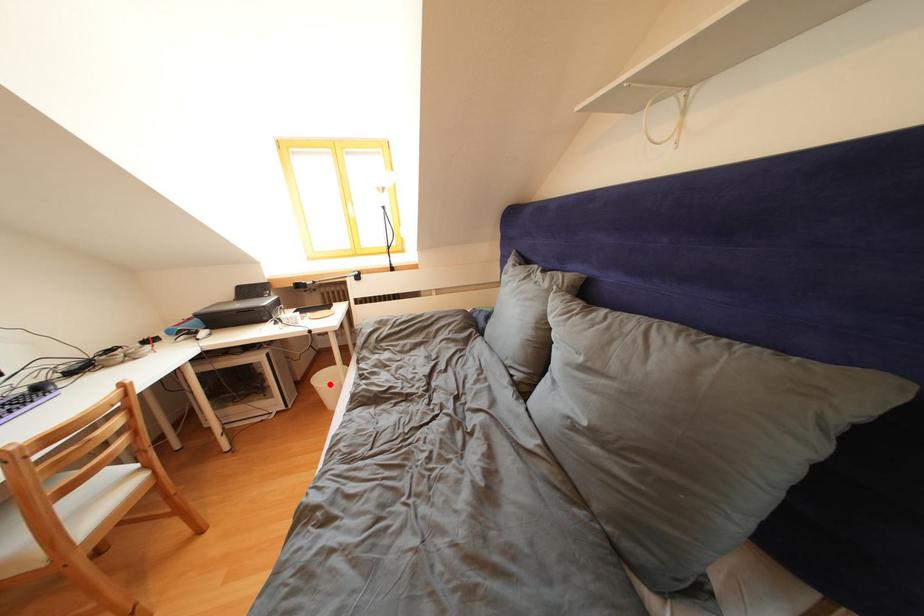
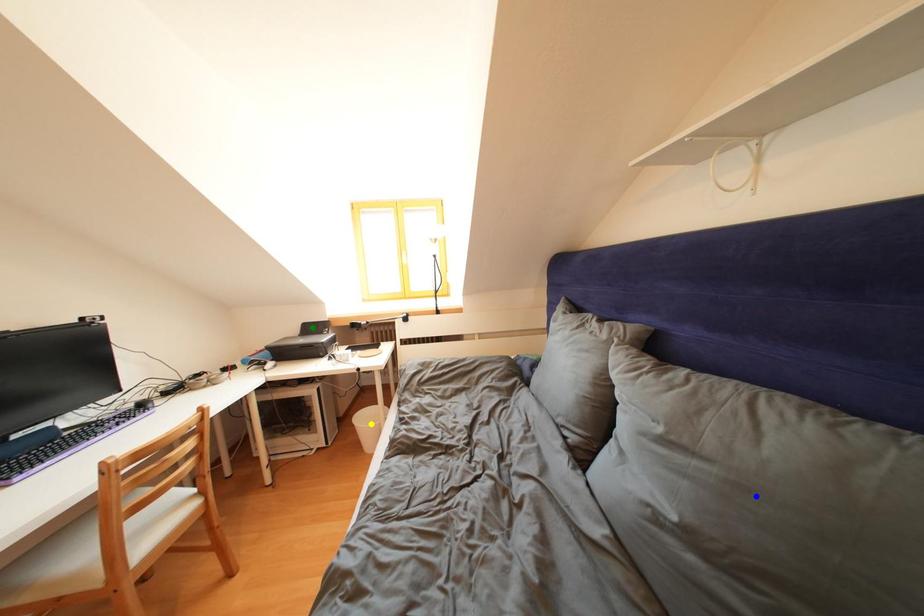
Question: I am providing you with two images of the same scene from different viewpoints. A red point is marked on the first image. You are given multiple points on the second image. Which mark in image 2 goes with the point in image 1?

Choices:
 (A) blue point
 (B) yellow point
 (C) green point

Answer: (B)